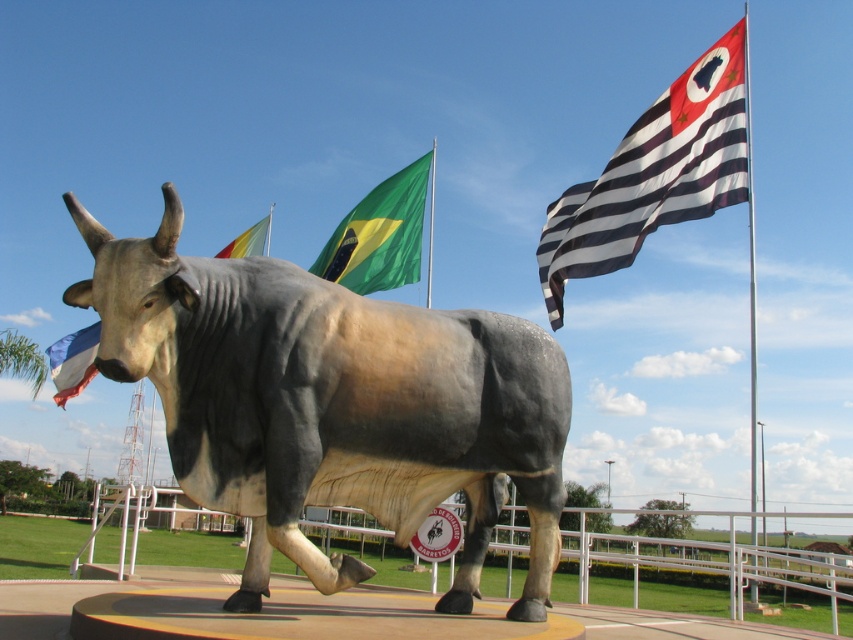
Who is more forward, (346, 260) or (270, 232)?

Point (346, 260)

Is green fabric flag at center positioned before green fabric flag pole at upper center?

Yes, it is in front of green fabric flag pole at upper center.

Where is `green fabric flag at center`? green fabric flag at center is located at coordinates (379, 234).

Who is more forward, (544, 573) or (270, 209)?

Point (544, 573)

At what (x,y) coordinates should I click in order to perform the action: click on polished bronze bull at center. Please return your answer as a coordinate pair (x, y). Looking at the image, I should click on (331, 403).

Between point (238, 240) and point (431, 220), which one is positioned in front?

Point (431, 220) is more forward.

Which is more to the left, polyester flag at upper center or green fabric flag pole at center?

polyester flag at upper center

Between point (254, 225) and point (428, 173), which one is positioned behind?

Positioned behind is point (254, 225).

At what (x,y) coordinates should I click in order to perform the action: click on polyester flag at upper center. Please return your answer as a coordinate pair (x, y). Image resolution: width=853 pixels, height=640 pixels. Looking at the image, I should click on (247, 241).